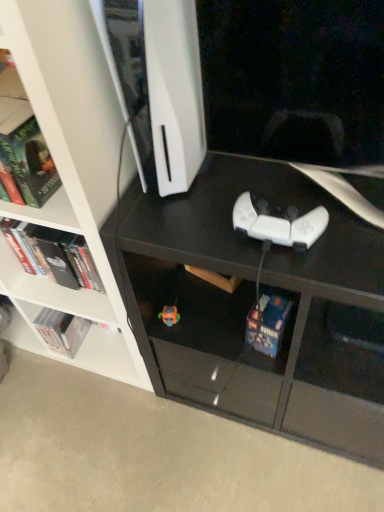
At what (x,y) coordinates should I click in order to perform the action: click on free location to the left of white matte game controller at center. Please return your answer as a coordinate pair (x, y). This screenshot has height=512, width=384. Looking at the image, I should click on (192, 223).